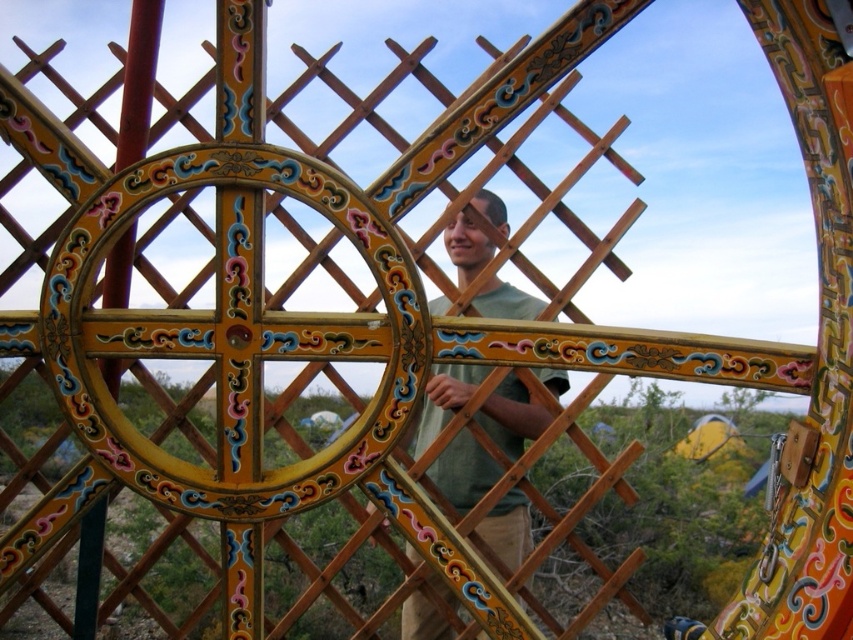
Question: Which object is closer to the camera taking this photo?

Choices:
 (A) green matte shirt at center
 (B) wooden lattice at center

Answer: (B)

Question: Can you confirm if wooden lattice at center is wider than green matte shirt at center?

Choices:
 (A) no
 (B) yes

Answer: (B)

Question: Which of the following is the farthest from the observer?

Choices:
 (A) wooden lattice at center
 (B) green matte shirt at center

Answer: (B)

Question: Does wooden lattice at center lie in front of green matte shirt at center?

Choices:
 (A) yes
 (B) no

Answer: (A)

Question: Can you confirm if wooden lattice at center is positioned below green matte shirt at center?

Choices:
 (A) yes
 (B) no

Answer: (B)